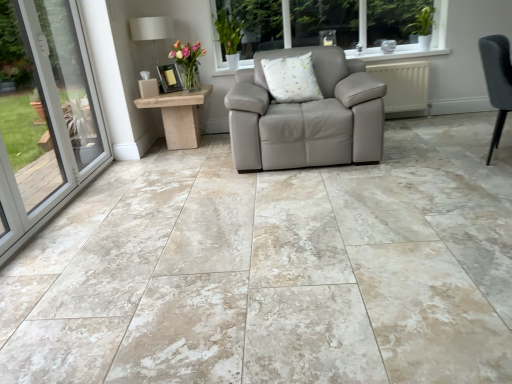
Locate an element on the screen. The image size is (512, 384). vacant space that is to the left of dark gray fabric chair at right is located at coordinates (426, 158).